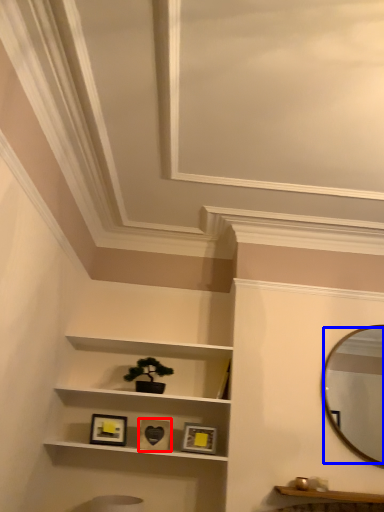
Question: Which object appears farthest to the camera in this image, picture frame (highlighted by a red box) or mirror (highlighted by a blue box)?

Choices:
 (A) picture frame
 (B) mirror

Answer: (A)